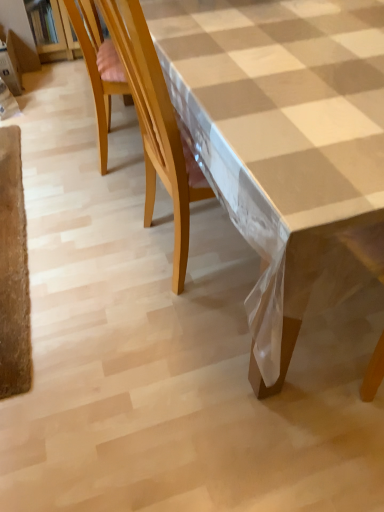
What do you see at coordinates (284, 128) in the screenshot? The width and height of the screenshot is (384, 512). I see `white checkered tablecloth at center` at bounding box center [284, 128].

From the picture: What is the approximate width of white checkered tablecloth at center?

white checkered tablecloth at center is 1.12 meters wide.

This screenshot has width=384, height=512. Identify the location of white checkered tablecloth at center. (284, 128).

Measure the distance between wooden chair at left and camera.

5.19 feet.

Find the location of a particular element. Image resolution: width=384 pixels, height=512 pixels. wooden chair at left is located at coordinates (95, 69).

The height and width of the screenshot is (512, 384). Describe the element at coordinates (95, 69) in the screenshot. I see `wooden chair at left` at that location.

This screenshot has height=512, width=384. I want to click on white checkered tablecloth at center, so click(284, 128).

Considering the relative positions of white checkered tablecloth at center and wooden chair at left in the image provided, is white checkered tablecloth at center to the right of wooden chair at left from the viewer's perspective?

Yes.

Which object is further away from the camera, white checkered tablecloth at center or wooden chair at left?

wooden chair at left is further from the camera.

Does point (314, 230) appear closer or farther from the camera than point (92, 42)?

Point (314, 230) is positioned closer to the camera compared to point (92, 42).

From the image's perspective, is white checkered tablecloth at center on wooden chair at left?

No.

From a real-world perspective, relative to wooden chair at left, is white checkered tablecloth at center vertically above or below?

Clearly, from a real-world perspective, white checkered tablecloth at center is above wooden chair at left.

Which object is thinner, white checkered tablecloth at center or wooden chair at left?

wooden chair at left is thinner.

In terms of height, does white checkered tablecloth at center look taller or shorter compared to wooden chair at left?

In the image, white checkered tablecloth at center appears to be taller than wooden chair at left.

Between white checkered tablecloth at center and wooden chair at left, which one has larger size?

With larger size is white checkered tablecloth at center.

Is white checkered tablecloth at center located outside wooden chair at left?

Yes, white checkered tablecloth at center is not within wooden chair at left.

Is white checkered tablecloth at center in contact with wooden chair at left?

They are not placed beside each other.

Is white checkered tablecloth at center oriented towards wooden chair at left?

Yes, white checkered tablecloth at center faces towards wooden chair at left.

In the image, there is a white checkered tablecloth at center. Where is `chair below it (from a real-world perspective)`? chair below it (from a real-world perspective) is located at coordinates (95, 69).

Does wooden chair at left appear on the left side of white checkered tablecloth at center?

Yes, wooden chair at left is to the left of white checkered tablecloth at center.

Is the depth of wooden chair at left less than that of white checkered tablecloth at center?

No.

Does point (101, 41) come behind point (313, 205)?

Yes, it is.

From the image's perspective, is wooden chair at left on top of white checkered tablecloth at center?

Correct, wooden chair at left appears higher than white checkered tablecloth at center in the image.

From a real-world perspective, who is located higher, wooden chair at left or white checkered tablecloth at center?

white checkered tablecloth at center, from a real-world perspective.

Looking at their sizes, would you say wooden chair at left is wider or thinner than white checkered tablecloth at center?

Clearly, wooden chair at left has less width compared to white checkered tablecloth at center.

Between wooden chair at left and white checkered tablecloth at center, which one has more height?

white checkered tablecloth at center.

Can you confirm if wooden chair at left is bigger than white checkered tablecloth at center?

Incorrect, wooden chair at left is not larger than white checkered tablecloth at center.

Do you think wooden chair at left is within white checkered tablecloth at center, or outside of it?

wooden chair at left is not inside white checkered tablecloth at center, it's outside.

Would you consider wooden chair at left to be distant from white checkered tablecloth at center?

No, wooden chair at left is in close proximity to white checkered tablecloth at center.

Is wooden chair at left facing towards white checkered tablecloth at center?

Yes, wooden chair at left faces towards white checkered tablecloth at center.

Can you tell me how much wooden chair at left and white checkered tablecloth at center differ in facing direction?

165 degrees separate the facing orientations of wooden chair at left and white checkered tablecloth at center.

How much distance is there between wooden chair at left and white checkered tablecloth at center?

30.22 inches.

This screenshot has height=512, width=384. In the image, there is a white checkered tablecloth at center. Identify the location of chair above it (from the image's perspective). (95, 69).

Where is `chair behind the white checkered tablecloth at center`? chair behind the white checkered tablecloth at center is located at coordinates (95, 69).

You are a GUI agent. You are given a task and a screenshot of the screen. Output one action in this format:
    pyautogui.click(x=<x>, y=<y>)
    Task: Click on the table to the right of wooden chair at left
    
    Given the screenshot: What is the action you would take?
    pyautogui.click(x=284, y=128)